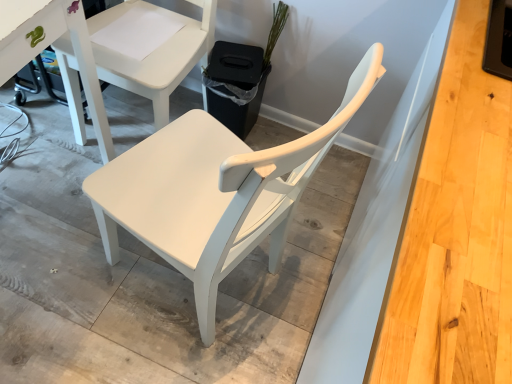
Question: In terms of height, does white matte chair at center, positioned as the 2th chair in top-to-bottom order, look taller or shorter compared to white matte chair at center, which is counted as the first chair, starting from the top?

Choices:
 (A) tall
 (B) short

Answer: (B)

Question: In the image, is white matte chair at center, positioned as the 2th chair in top-to-bottom order, positioned in front of or behind white matte chair at center, which is the 2th chair from bottom to top?

Choices:
 (A) front
 (B) behind

Answer: (A)

Question: Which of these objects is positioned farthest from the green matte plant at upper center?

Choices:
 (A) white matte chair at center, positioned as the 2th chair in top-to-bottom order
 (B) white matte chair at center, which is the 2th chair from bottom to top

Answer: (A)

Question: Which object is the closest to the green matte plant at upper center?

Choices:
 (A) white matte chair at center, marked as the first chair in a bottom-to-top arrangement
 (B) white matte chair at center, which is counted as the first chair, starting from the top

Answer: (B)